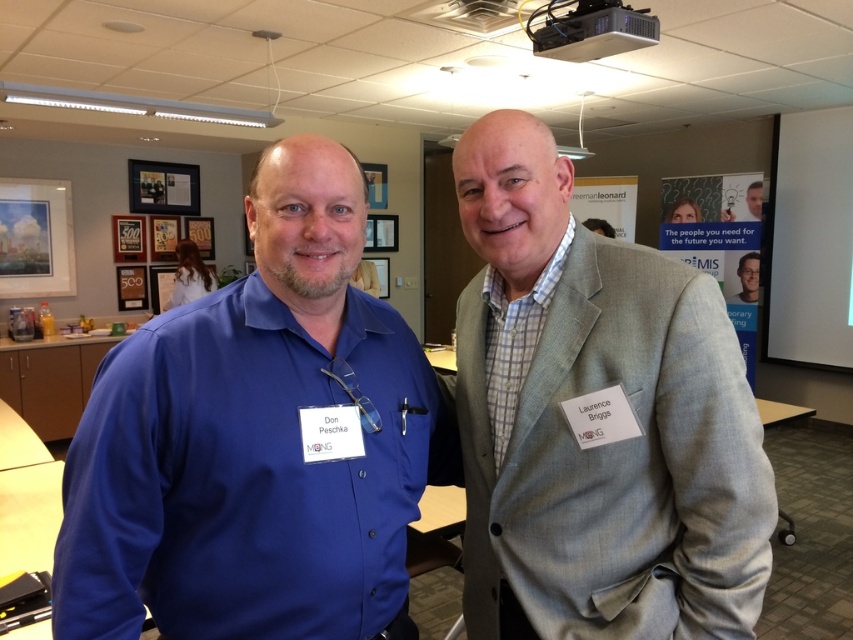
You are standing in the room and want to read the name tag of the person wearing the matte blue shirt at left. Can you see the white matte projector screen at upper right above their head?

Yes, the matte blue shirt at left is below the white matte projector screen at upper right, so the screen is positioned above their head and visible.

You are organizing a photo shoot and need to ensure that the matte blue shirt at left and the white fabric at upper left are visible in the frame. Given their sizes, which one might require adjusting the camera angle to capture fully?

The matte blue shirt at left is taller than the white fabric at upper left, so the matte blue shirt at left might require adjusting the camera angle to capture fully since it is taller.